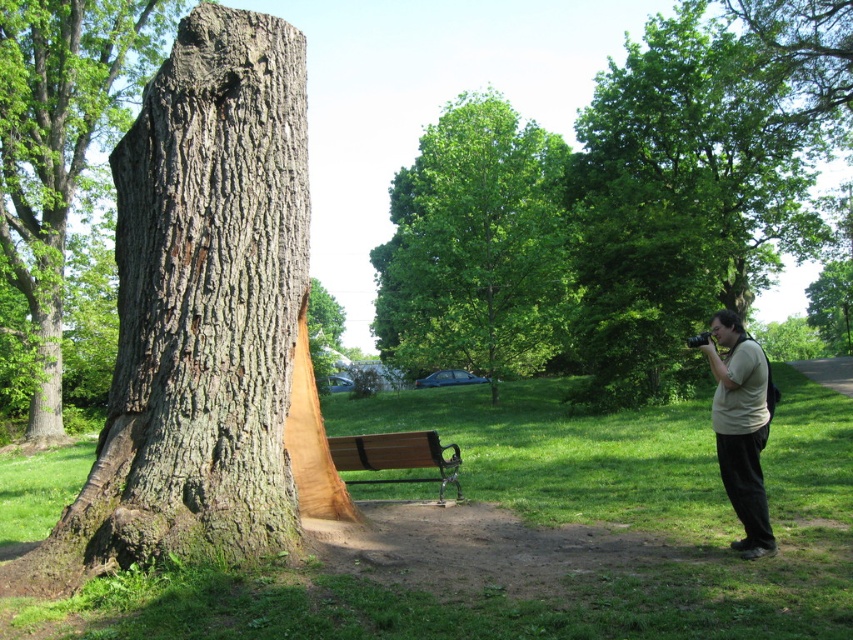
You are a park visitor standing near the tree trunk. You see a light beige shirt at right and a brown wooden bench at center. Which object is closer to your right side?

The light beige shirt at right is closer to your right side because it is positioned to the right of the brown wooden bench at center.

You are standing in the park and want to take a photo of the green leafy tree at center without the light beige shirt at right appearing in the shot. How can you adjust your position to achieve this?

Since the green leafy tree at center is positioned over the light beige shirt at right, you can move to the left side of the green leafy tree at center to take the photo. This will ensure the light beige shirt at right is out of frame.

You are standing at the park and want to take a photo of the green leafy tree at center. You have a camera that can focus up to 30 meters. Will you be able to capture the tree clearly if you are standing at the position of the light beige shirt at right?

The distance between the green leafy tree at center and the light beige shirt at right is 28.54 meters, which is within the camera focus range of 30 meters. Therefore, you can capture the tree clearly from that position.